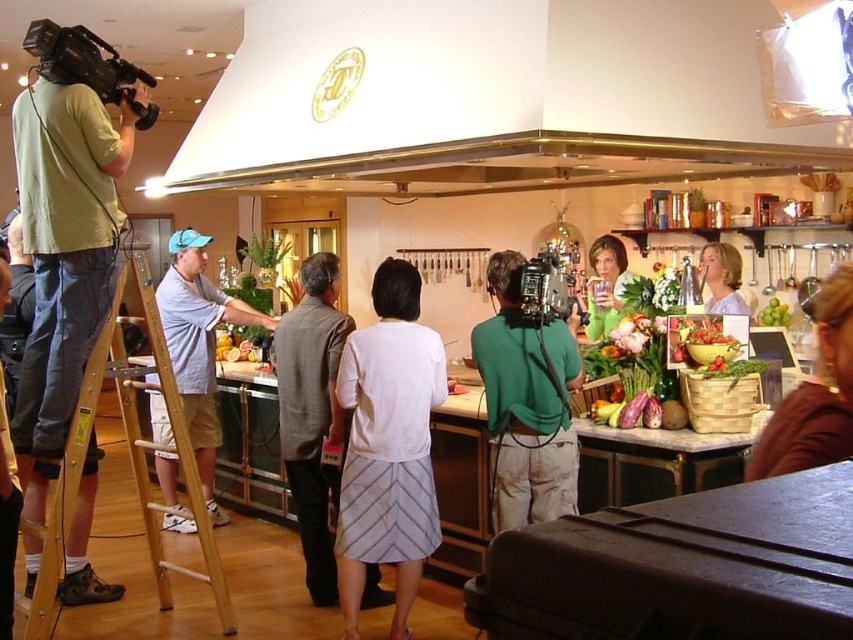
You are a photographer standing in the kitchen and need to position a tall tripod. You see the blue denim shirt at left and the black matte video camera at upper left. Which object should you place the tripod behind to ensure it doesn

The blue denim shirt at left has a greater height compared to the black matte video camera at upper left. Therefore, you should place the tripod behind the blue denim shirt at left to ensure it is tall enough to support the tripod.